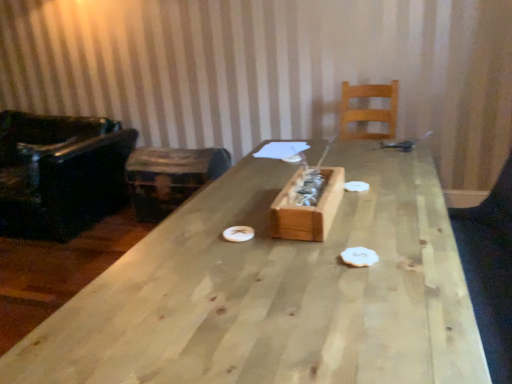
Question: From the image's perspective, would you say white matte paper plate at center, acting as the second paper plate starting from the left, is shown under natural wood table at center?

Choices:
 (A) yes
 (B) no

Answer: (B)

Question: Is white matte paper plate at center, marked as the first paper plate in a top-to-bottom arrangement, oriented away from natural wood table at center?

Choices:
 (A) yes
 (B) no

Answer: (A)

Question: Does white matte paper plate at center, which appears as the first paper plate when viewed from the right, have a larger size compared to natural wood table at center?

Choices:
 (A) yes
 (B) no

Answer: (B)

Question: Can you confirm if white matte paper plate at center, which ranks as the 1th paper plate in back-to-front order, is wider than natural wood table at center?

Choices:
 (A) no
 (B) yes

Answer: (A)

Question: Is white matte paper plate at center, which ranks as the 1th paper plate in back-to-front order, not within natural wood table at center?

Choices:
 (A) no
 (B) yes

Answer: (A)

Question: In terms of height, does white matte paper plate at center, which ranks as the 1th paper plate in back-to-front order, look taller or shorter compared to wooden trunk at left?

Choices:
 (A) tall
 (B) short

Answer: (B)

Question: From a real-world perspective, is white matte paper plate at center, acting as the second paper plate starting from the left, positioned above or below wooden trunk at left?

Choices:
 (A) below
 (B) above

Answer: (B)

Question: From the image's perspective, is white matte paper plate at center, marked as the first paper plate in a top-to-bottom arrangement, above or below wooden trunk at left?

Choices:
 (A) below
 (B) above

Answer: (A)

Question: Choose the correct answer: Is white matte paper plate at center, marked as the first paper plate in a top-to-bottom arrangement, inside wooden trunk at left or outside it?

Choices:
 (A) outside
 (B) inside

Answer: (A)

Question: From their relative heights in the image, would you say black leather chair at left, which ranks as the first chair in left-to-right order, is taller or shorter than natural wood table at center?

Choices:
 (A) tall
 (B) short

Answer: (A)

Question: Visually, is black leather chair at left, which ranks as the first chair in left-to-right order, positioned to the left or to the right of natural wood table at center?

Choices:
 (A) right
 (B) left

Answer: (B)

Question: From a real-world perspective, is black leather chair at left, positioned as the second chair in right-to-left order, above or below natural wood table at center?

Choices:
 (A) below
 (B) above

Answer: (B)

Question: From the image's perspective, is black leather chair at left, which ranks as the first chair in left-to-right order, located above or below natural wood table at center?

Choices:
 (A) below
 (B) above

Answer: (B)

Question: Considering their positions, is white matte paper plate at center, the 1th paper plate from the front, located in front of or behind wooden box at center?

Choices:
 (A) behind
 (B) front

Answer: (A)

Question: Looking at the image, does white matte paper plate at center, the 1th paper plate in the bottom-to-top sequence, seem bigger or smaller compared to wooden box at center?

Choices:
 (A) big
 (B) small

Answer: (B)